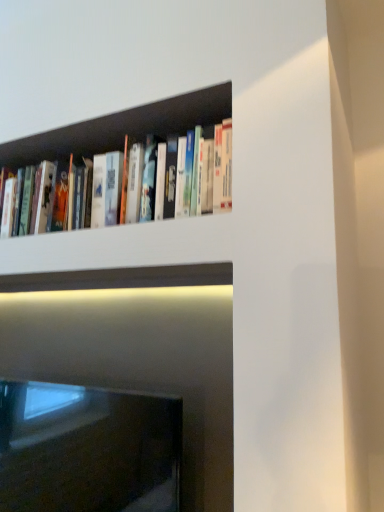
Locate an element on the screen. Image resolution: width=384 pixels, height=512 pixels. hardcover books at upper left is located at coordinates (101, 136).

This screenshot has width=384, height=512. What do you see at coordinates (101, 136) in the screenshot? I see `hardcover books at upper left` at bounding box center [101, 136].

What is the approximate height of hardcover books at upper left?

The height of hardcover books at upper left is 10.45 inches.

In order to click on black glass fireplace at lower left in this screenshot , I will do `click(88, 450)`.

This screenshot has height=512, width=384. What do you see at coordinates (88, 450) in the screenshot?
I see `black glass fireplace at lower left` at bounding box center [88, 450].

What is the approximate height of black glass fireplace at lower left?

16.19 inches.

You are a GUI agent. You are given a task and a screenshot of the screen. Output one action in this format:
    pyautogui.click(x=<x>, y=<y>)
    Task: Click on the hardcover books at upper left
    The image size is (384, 512).
    Given the screenshot: What is the action you would take?
    click(101, 136)

Considering the positions of objects black glass fireplace at lower left and hardcover books at upper left in the image provided, who is more to the right, black glass fireplace at lower left or hardcover books at upper left?

From the viewer's perspective, hardcover books at upper left appears more on the right side.

Is black glass fireplace at lower left closer to the viewer compared to hardcover books at upper left?

That is False.

Which is in front, point (143, 452) or point (38, 145)?

The point (143, 452) is in front.

From the image's perspective, is black glass fireplace at lower left on top of hardcover books at upper left?

No.

From a real-world perspective, is black glass fireplace at lower left over hardcover books at upper left?

No, from a real-world perspective, black glass fireplace at lower left is not over hardcover books at upper left

In terms of width, does black glass fireplace at lower left look wider or thinner when compared to hardcover books at upper left?

In the image, black glass fireplace at lower left appears to be more narrow than hardcover books at upper left.

Is black glass fireplace at lower left shorter than hardcover books at upper left?

No.

Between black glass fireplace at lower left and hardcover books at upper left, which one has smaller size?

With smaller size is hardcover books at upper left.

Would you say black glass fireplace at lower left contains hardcover books at upper left?

No.

Is black glass fireplace at lower left directly adjacent to hardcover books at upper left?

black glass fireplace at lower left and hardcover books at upper left are not in contact.

Is black glass fireplace at lower left looking in the opposite direction of hardcover books at upper left?

black glass fireplace at lower left does not have its back to hardcover books at upper left.

You are a GUI agent. You are given a task and a screenshot of the screen. Output one action in this format:
    pyautogui.click(x=<x>, y=<y>)
    Task: Click on the book above the black glass fireplace at lower left (from the image's perspective)
    The height and width of the screenshot is (512, 384).
    Given the screenshot: What is the action you would take?
    tap(101, 136)

Based on their positions, is hardcover books at upper left located to the left or right of black glass fireplace at lower left?

From the image, it's evident that hardcover books at upper left is to the right of black glass fireplace at lower left.

Is hardcover books at upper left in front of or behind black glass fireplace at lower left in the image?

Visually, hardcover books at upper left is located in front of black glass fireplace at lower left.

Is point (22, 139) closer or farther from the camera than point (9, 426)?

Clearly, point (22, 139) is closer to the camera than point (9, 426).

From the image's perspective, between hardcover books at upper left and black glass fireplace at lower left, which one is located above?

hardcover books at upper left, from the image's perspective.

From a real-world perspective, which is physically below, hardcover books at upper left or black glass fireplace at lower left?

From a 3D spatial view, black glass fireplace at lower left is below.

Considering the sizes of objects hardcover books at upper left and black glass fireplace at lower left in the image provided, who is wider, hardcover books at upper left or black glass fireplace at lower left?

Wider between the two is hardcover books at upper left.

Considering the sizes of objects hardcover books at upper left and black glass fireplace at lower left in the image provided, who is shorter, hardcover books at upper left or black glass fireplace at lower left?

hardcover books at upper left is shorter.

Considering the relative sizes of hardcover books at upper left and black glass fireplace at lower left in the image provided, is hardcover books at upper left smaller than black glass fireplace at lower left?

Correct, hardcover books at upper left occupies less space than black glass fireplace at lower left.

Is hardcover books at upper left inside the boundaries of black glass fireplace at lower left, or outside?

hardcover books at upper left lies outside black glass fireplace at lower left.

Is hardcover books at upper left far from black glass fireplace at lower left?

No, there isn't a large distance between hardcover books at upper left and black glass fireplace at lower left.

Is hardcover books at upper left turned away from black glass fireplace at lower left?

No, hardcover books at upper left is not facing the opposite direction of black glass fireplace at lower left.

How many degrees apart are the facing directions of hardcover books at upper left and black glass fireplace at lower left?

The facing directions of hardcover books at upper left and black glass fireplace at lower left are 0.00154 degrees apart.

Identify the location of book in front of the black glass fireplace at lower left. (101, 136).

Locate an element on the screen. This screenshot has height=512, width=384. fireplace below the hardcover books at upper left (from a real-world perspective) is located at coordinates (88, 450).

You are a GUI agent. You are given a task and a screenshot of the screen. Output one action in this format:
    pyautogui.click(x=<x>, y=<y>)
    Task: Click on the book in front of the black glass fireplace at lower left
    The height and width of the screenshot is (512, 384).
    Given the screenshot: What is the action you would take?
    pyautogui.click(x=101, y=136)